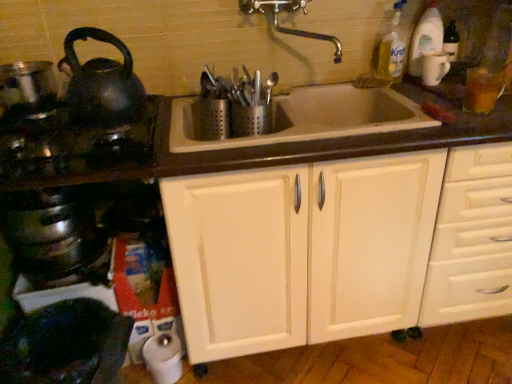
The image size is (512, 384). Find the location of `free space in front of yellow plastic bottle at upper right, which is the first bottle in left-to-right order`. free space in front of yellow plastic bottle at upper right, which is the first bottle in left-to-right order is located at coordinates click(x=413, y=89).